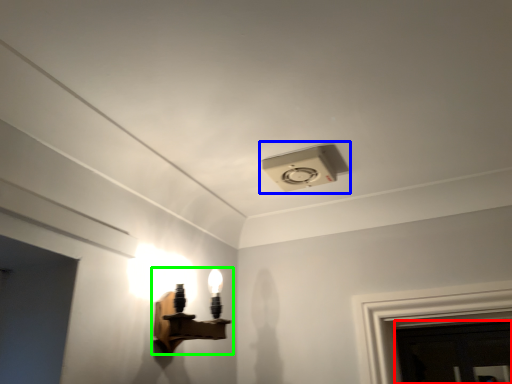
Question: Considering the real-world distances, which object is farthest from door (highlighted by a red box)? lamp (highlighted by a blue box) or lamp (highlighted by a green box)?

Choices:
 (A) lamp
 (B) lamp

Answer: (A)